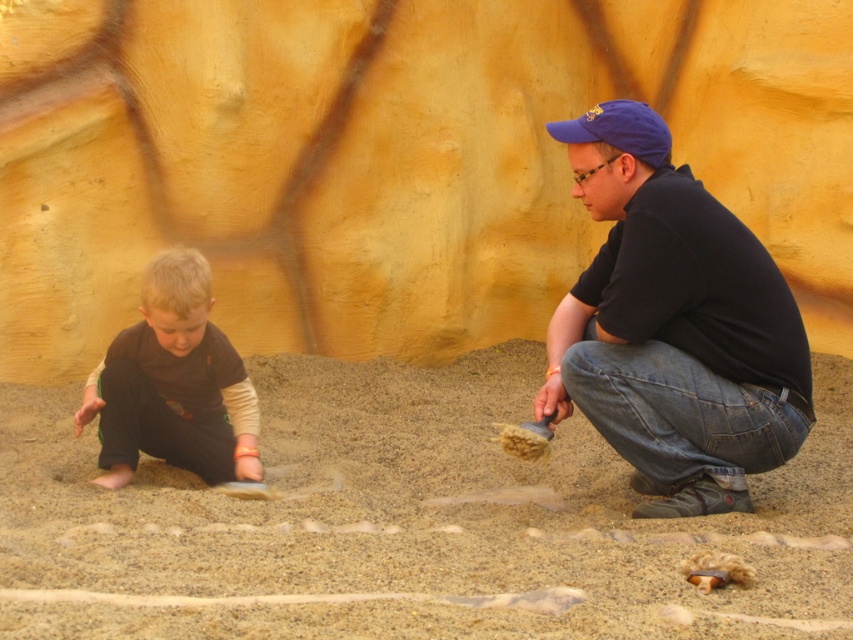
What is the 2D coordinate of the dark brown fabric pants at lower left in the image?

The 2D coordinate of the dark brown fabric pants at lower left is at point (173, 385).